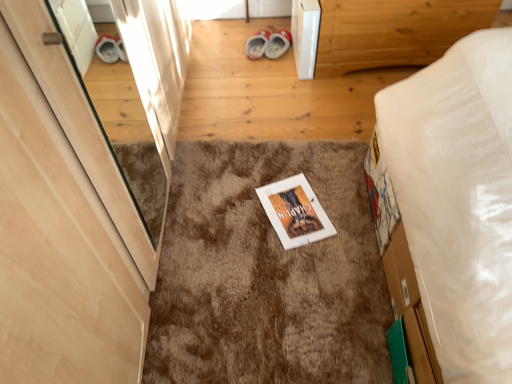
Question: Visually, is wooden bed frame at upper right positioned to the left or to the right of light wood door at left?

Choices:
 (A) right
 (B) left

Answer: (A)

Question: From their relative heights in the image, would you say wooden bed frame at upper right is taller or shorter than light wood door at left?

Choices:
 (A) tall
 (B) short

Answer: (B)

Question: Which object is the closest to the brown shaggy carpet at center?

Choices:
 (A) light wood door at left
 (B) wooden bed frame at upper right
 (C) red suede shoes at center

Answer: (A)

Question: Which object is positioned closest to the wooden bed frame at upper right?

Choices:
 (A) light wood door at left
 (B) brown shaggy carpet at center
 (C) red suede shoes at center

Answer: (C)